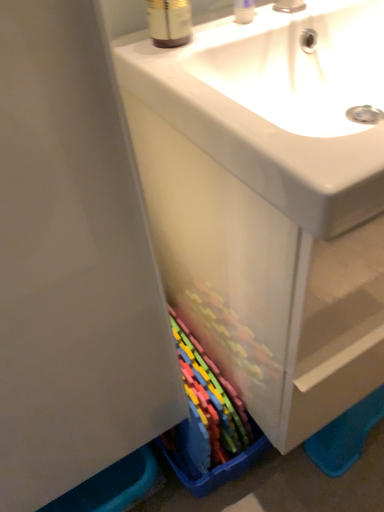
Question: Is clear plastic container at upper center oriented towards matte plastic cabinet at center?

Choices:
 (A) yes
 (B) no

Answer: (B)

Question: Is clear plastic container at upper center located outside matte plastic cabinet at center?

Choices:
 (A) yes
 (B) no

Answer: (A)

Question: Is clear plastic container at upper center in contact with matte plastic cabinet at center?

Choices:
 (A) no
 (B) yes

Answer: (A)

Question: Is clear plastic container at upper center far from matte plastic cabinet at center?

Choices:
 (A) yes
 (B) no

Answer: (B)

Question: Does clear plastic container at upper center have a lesser width compared to matte plastic cabinet at center?

Choices:
 (A) yes
 (B) no

Answer: (A)

Question: Is clear plastic container at upper center taller or shorter than brown plastic bottle at upper center?

Choices:
 (A) short
 (B) tall

Answer: (A)

Question: From a real-world perspective, is clear plastic container at upper center physically located above or below brown plastic bottle at upper center?

Choices:
 (A) below
 (B) above

Answer: (A)

Question: Considering the positions of point (246, 11) and point (162, 3), is point (246, 11) closer or farther from the camera than point (162, 3)?

Choices:
 (A) closer
 (B) farther

Answer: (B)

Question: Looking at the image, does clear plastic container at upper center seem bigger or smaller compared to brown plastic bottle at upper center?

Choices:
 (A) big
 (B) small

Answer: (B)

Question: In terms of width, does matte plastic cabinet at center look wider or thinner when compared to clear plastic container at upper center?

Choices:
 (A) wide
 (B) thin

Answer: (A)

Question: From a real-world perspective, is matte plastic cabinet at center positioned above or below clear plastic container at upper center?

Choices:
 (A) below
 (B) above

Answer: (A)

Question: Considering their positions, is matte plastic cabinet at center located in front of or behind clear plastic container at upper center?

Choices:
 (A) front
 (B) behind

Answer: (A)

Question: From the image's perspective, relative to clear plastic container at upper center, is matte plastic cabinet at center above or below?

Choices:
 (A) below
 (B) above

Answer: (A)

Question: In the image, is brown plastic bottle at upper center on the left side or the right side of matte plastic cabinet at center?

Choices:
 (A) right
 (B) left

Answer: (B)

Question: Is point (165, 29) closer or farther from the camera than point (344, 296)?

Choices:
 (A) closer
 (B) farther

Answer: (B)